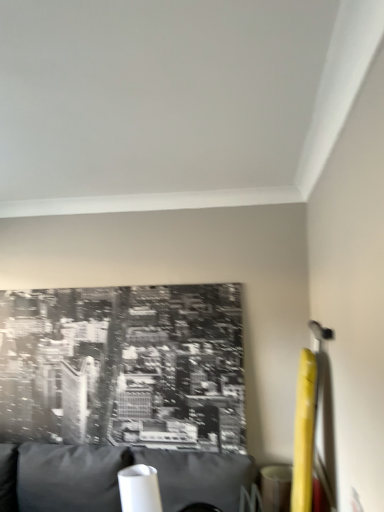
Question: Considering the positions of point (158, 490) and point (168, 476), is point (158, 490) closer or farther from the camera than point (168, 476)?

Choices:
 (A) closer
 (B) farther

Answer: (A)

Question: From the image's perspective, is white glossy table lamp at lower center positioned above or below matte gray couch at lower left?

Choices:
 (A) above
 (B) below

Answer: (A)

Question: Is white glossy table lamp at lower center inside or outside of matte gray couch at lower left?

Choices:
 (A) inside
 (B) outside

Answer: (A)

Question: In terms of width, does matte gray couch at lower left look wider or thinner when compared to white glossy table lamp at lower center?

Choices:
 (A) wide
 (B) thin

Answer: (A)

Question: Relative to white glossy table lamp at lower center, is matte gray couch at lower left in front or behind?

Choices:
 (A) front
 (B) behind

Answer: (A)

Question: From their relative heights in the image, would you say matte gray couch at lower left is taller or shorter than white glossy table lamp at lower center?

Choices:
 (A) tall
 (B) short

Answer: (A)

Question: From the image's perspective, is matte gray couch at lower left located above or below white glossy table lamp at lower center?

Choices:
 (A) above
 (B) below

Answer: (B)